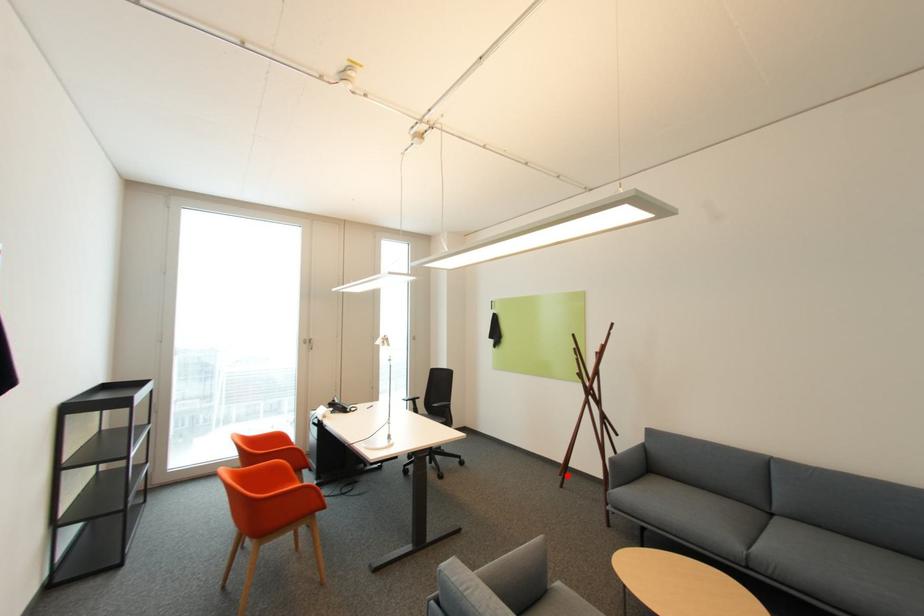
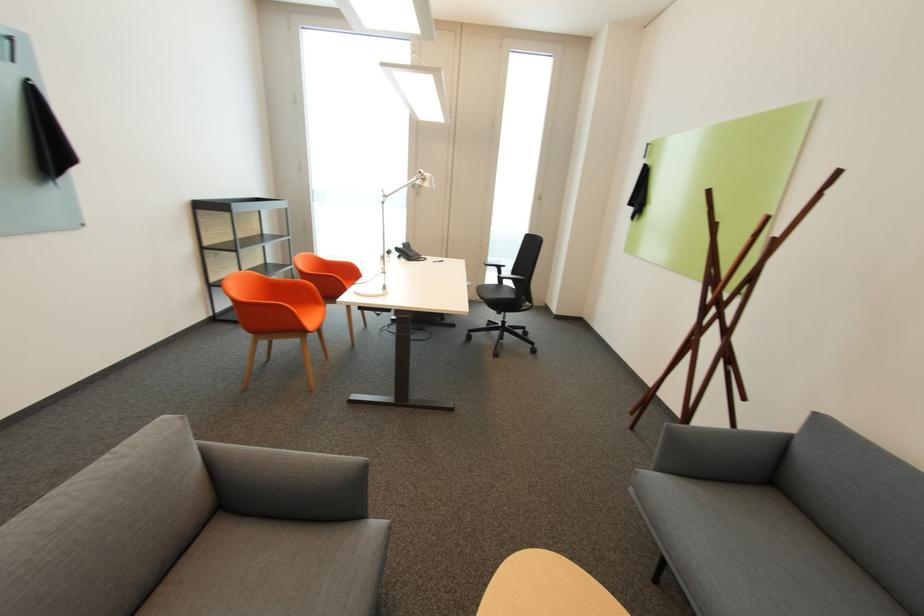
In the second image, find the point that corresponds to the highlighted location in the first image.

(638, 414)